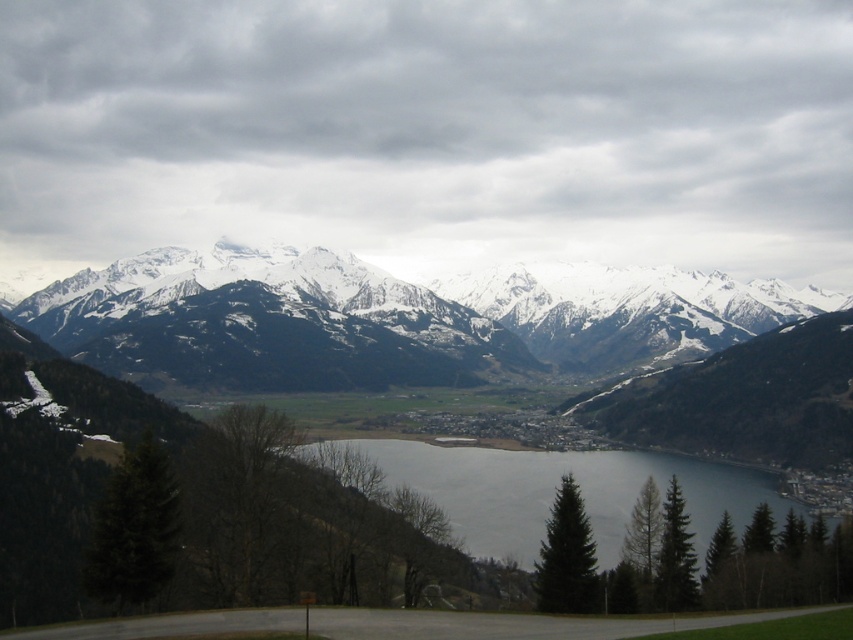
The image size is (853, 640). Describe the element at coordinates (387, 317) in the screenshot. I see `white snow-covered mountains at upper center` at that location.

Is white snow-covered mountains at upper center wider than gray water at center?

Yes, white snow-covered mountains at upper center is wider than gray water at center.

Where is `white snow-covered mountains at upper center`? white snow-covered mountains at upper center is located at coordinates (387, 317).